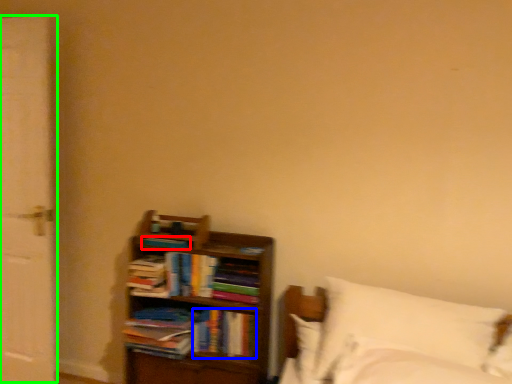
Question: Which object is the farthest from book (highlighted by a red box)? Choose among these: book (highlighted by a blue box) or screen door (highlighted by a green box).

Choices:
 (A) book
 (B) screen door

Answer: (B)